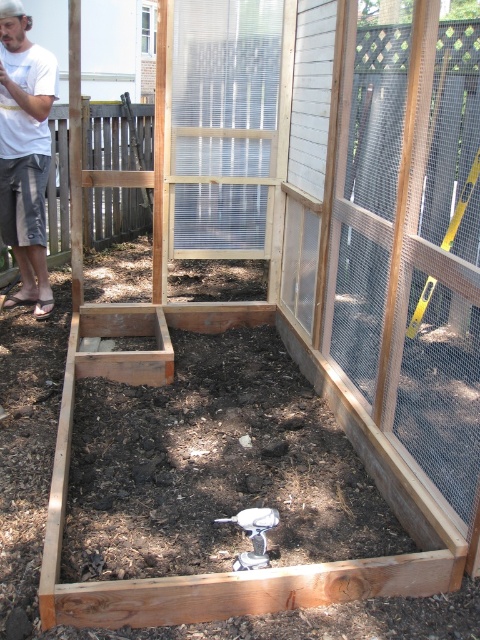
Question: Among these points, which one is farthest from the camera?

Choices:
 (A) (19, 218)
 (B) (262, 116)

Answer: (A)

Question: Which of the following is the farthest from the observer?

Choices:
 (A) white cotton shirt at upper left
 (B) clear plastic screen door at center

Answer: (A)

Question: Can you confirm if clear plastic screen door at center is wider than white cotton shirt at upper left?

Choices:
 (A) no
 (B) yes

Answer: (B)

Question: Can you confirm if clear plastic screen door at center is positioned above white cotton shirt at upper left?

Choices:
 (A) no
 (B) yes

Answer: (B)

Question: Which of the following is the farthest from the observer?

Choices:
 (A) white cotton shirt at upper left
 (B) clear plastic screen door at center

Answer: (A)

Question: Is clear plastic screen door at center closer to the viewer compared to white cotton shirt at upper left?

Choices:
 (A) no
 (B) yes

Answer: (B)